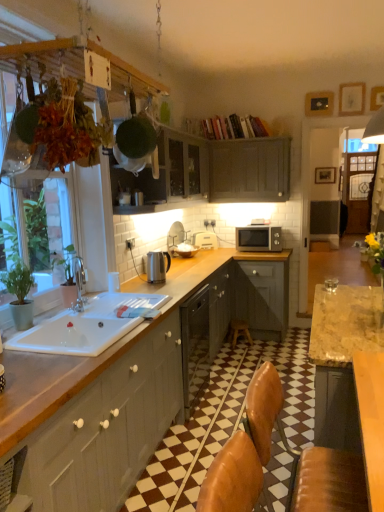
Question: Does white plastic toaster at upper center, which ranks as the second appliance in front-to-back order, have a larger size compared to matte gray cabinet at upper center, placed as the 2th cabinetry when sorted from bottom to top?

Choices:
 (A) no
 (B) yes

Answer: (A)

Question: Can you confirm if white plastic toaster at upper center, placed as the 1th appliance when sorted from back to front, is shorter than matte gray cabinet at upper center, the 2th cabinetry when ordered from top to bottom?

Choices:
 (A) no
 (B) yes

Answer: (B)

Question: Are white plastic toaster at upper center, the 1th appliance viewed from the right, and matte gray cabinet at upper center, the 2th cabinetry when ordered from top to bottom, far apart?

Choices:
 (A) no
 (B) yes

Answer: (A)

Question: Considering the relative sizes of white plastic toaster at upper center, the 2th appliance viewed from the left, and matte gray cabinet at upper center, the 2th cabinetry when ordered from top to bottom, in the image provided, is white plastic toaster at upper center, the 2th appliance viewed from the left, thinner than matte gray cabinet at upper center, the 2th cabinetry when ordered from top to bottom,?

Choices:
 (A) no
 (B) yes

Answer: (B)

Question: Is white plastic toaster at upper center, which ranks as the second appliance in front-to-back order, completely or partially outside of matte gray cabinet at upper center, placed as the 2th cabinetry when sorted from bottom to top?

Choices:
 (A) no
 (B) yes

Answer: (B)

Question: In terms of size, does white ceramic sink at lower left appear bigger or smaller than white plastic toaster at upper center, the 2th appliance viewed from the left?

Choices:
 (A) small
 (B) big

Answer: (B)

Question: From a real-world perspective, relative to white plastic toaster at upper center, which ranks as the second appliance in front-to-back order, is white ceramic sink at lower left vertically above or below?

Choices:
 (A) below
 (B) above

Answer: (A)

Question: Considering the relative positions of white ceramic sink at lower left and white plastic toaster at upper center, which is the second appliance from bottom to top, in the image provided, is white ceramic sink at lower left to the left or to the right of white plastic toaster at upper center, which is the second appliance from bottom to top,?

Choices:
 (A) left
 (B) right

Answer: (A)

Question: Does point (100, 310) appear closer or farther from the camera than point (198, 241)?

Choices:
 (A) closer
 (B) farther

Answer: (A)

Question: Is satin silver microwave at upper right inside the boundaries of matte gray cabinet at left, marked as the 1th cabinetry in a bottom-to-top arrangement, or outside?

Choices:
 (A) inside
 (B) outside

Answer: (B)

Question: In the image, is satin silver microwave at upper right on the left side or the right side of matte gray cabinet at left, marked as the third cabinetry in a top-to-bottom arrangement?

Choices:
 (A) left
 (B) right

Answer: (B)

Question: Looking at their shapes, would you say satin silver microwave at upper right is wider or thinner than matte gray cabinet at left, marked as the 1th cabinetry in a bottom-to-top arrangement?

Choices:
 (A) thin
 (B) wide

Answer: (A)

Question: From a real-world perspective, relative to matte gray cabinet at left, marked as the 1th cabinetry in a bottom-to-top arrangement, is satin silver microwave at upper right vertically above or below?

Choices:
 (A) above
 (B) below

Answer: (A)

Question: Is white plastic toaster at upper center, the 1th appliance viewed from the right, taller or shorter than green matte plant hanger at upper left?

Choices:
 (A) tall
 (B) short

Answer: (B)

Question: Do you think white plastic toaster at upper center, the 1th appliance viewed from the right, is within green matte plant hanger at upper left, or outside of it?

Choices:
 (A) inside
 (B) outside

Answer: (B)